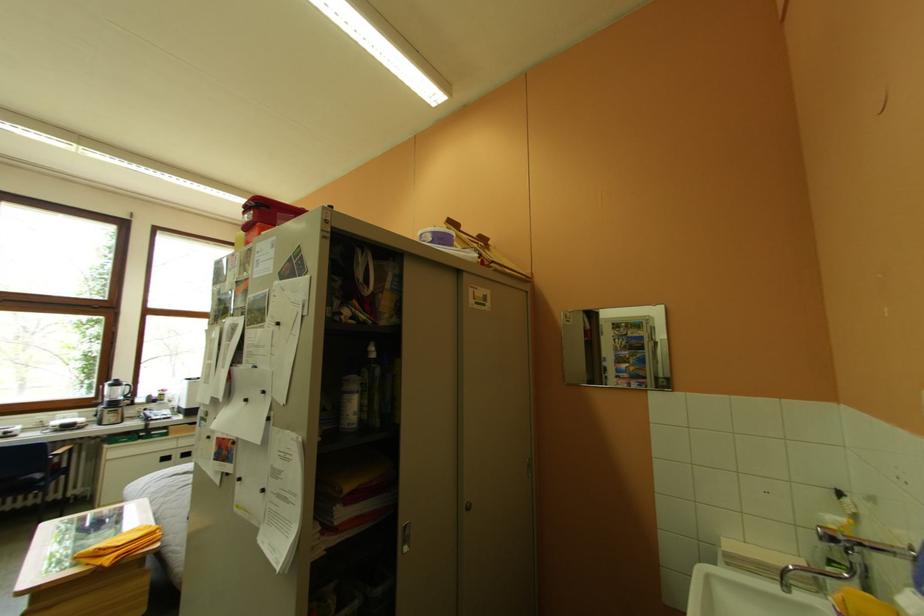
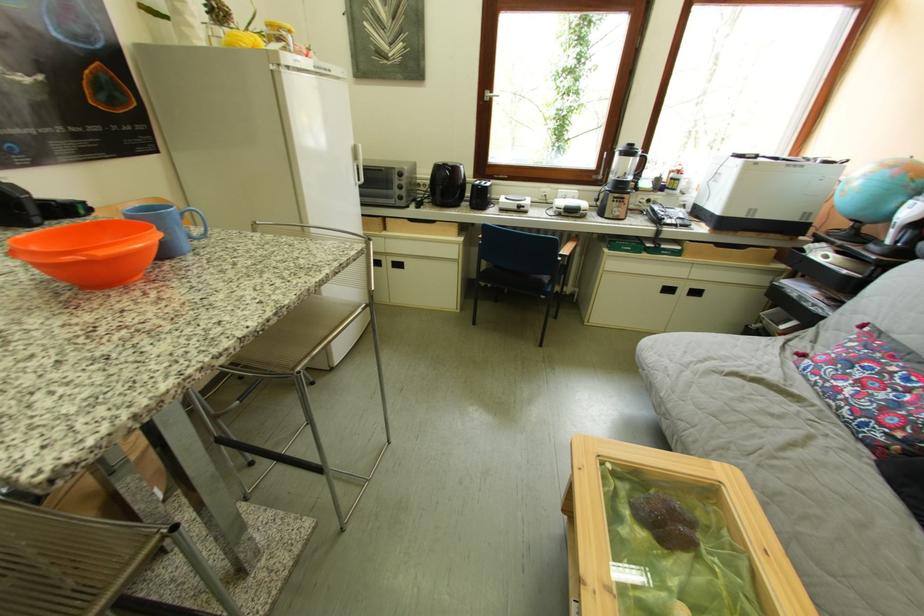
In the second image, find the point that corresponds to [178,434] in the first image.

(690, 251)